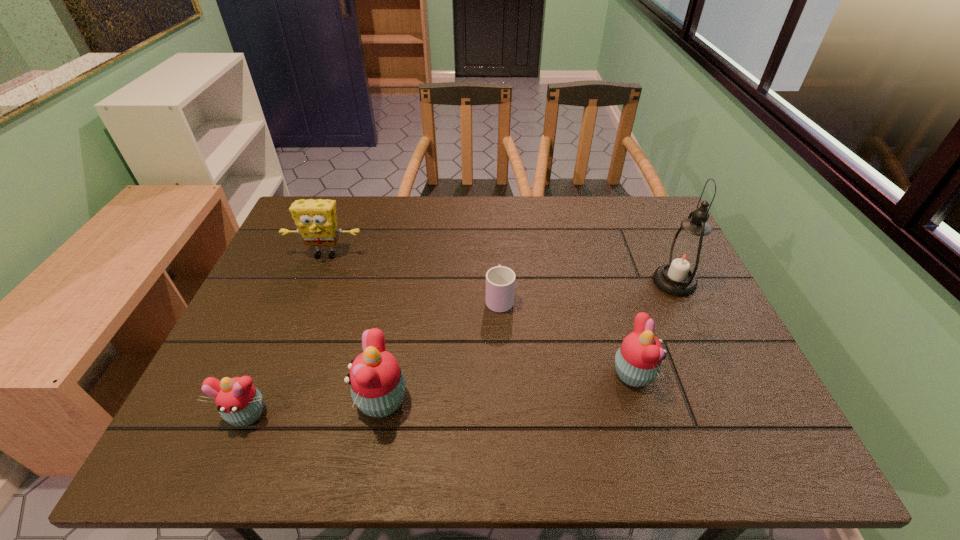
To achieve even spacing by inserting another cupcake among them, please point to a vacant spot for this new cupcake. Please provide its 2D coordinates. Your answer should be formatted as a tuple, i.e. [(x, y)], where the tuple contains the x and y coordinates of a point satisfying the conditions above.

[(511, 387)]